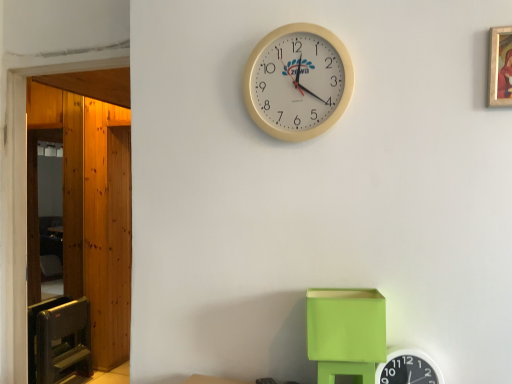
Question: Is gold-framed painting at upper right inside or outside of beige plastic wall clock at upper center, which is the second wall clock in right-to-left order?

Choices:
 (A) outside
 (B) inside

Answer: (A)

Question: Is point (500, 96) closer or farther from the camera than point (269, 82)?

Choices:
 (A) farther
 (B) closer

Answer: (B)

Question: Which of these objects is positioned farthest from the gold-framed painting at upper right?

Choices:
 (A) beige plastic wall clock at upper center, placed as the first wall clock when sorted from top to bottom
 (B) wooden door at left
 (C) white plastic wall clock at upper center, which is the 2th wall clock in left-to-right order
 (D) lime green plastic cube at lower center

Answer: (B)

Question: Estimate the real-world distances between objects in this image. Which object is farther from the wooden door at left?

Choices:
 (A) beige plastic wall clock at upper center, which is the 2th wall clock in bottom-to-top order
 (B) lime green plastic cube at lower center
 (C) gold-framed painting at upper right
 (D) white plastic wall clock at upper center, which is the 2th wall clock in left-to-right order

Answer: (C)